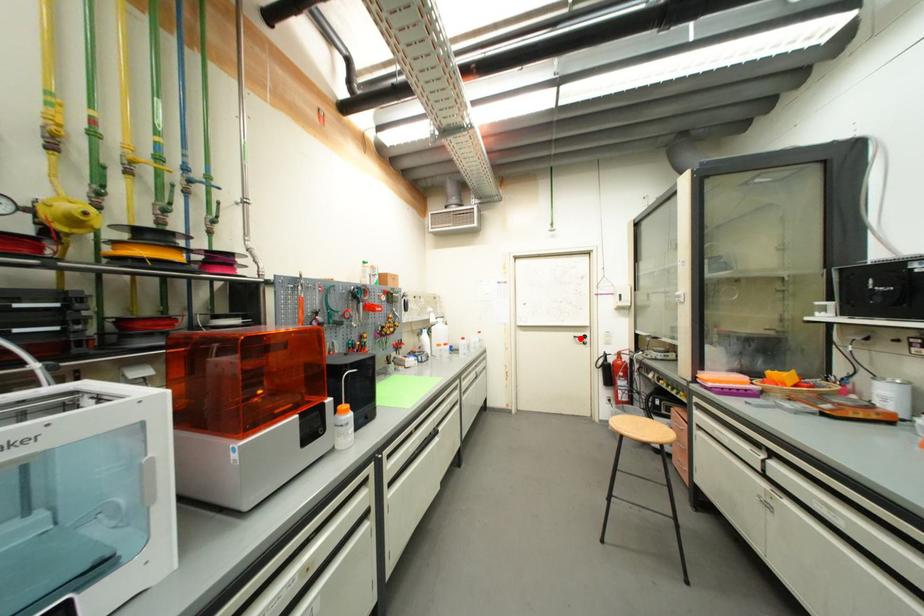
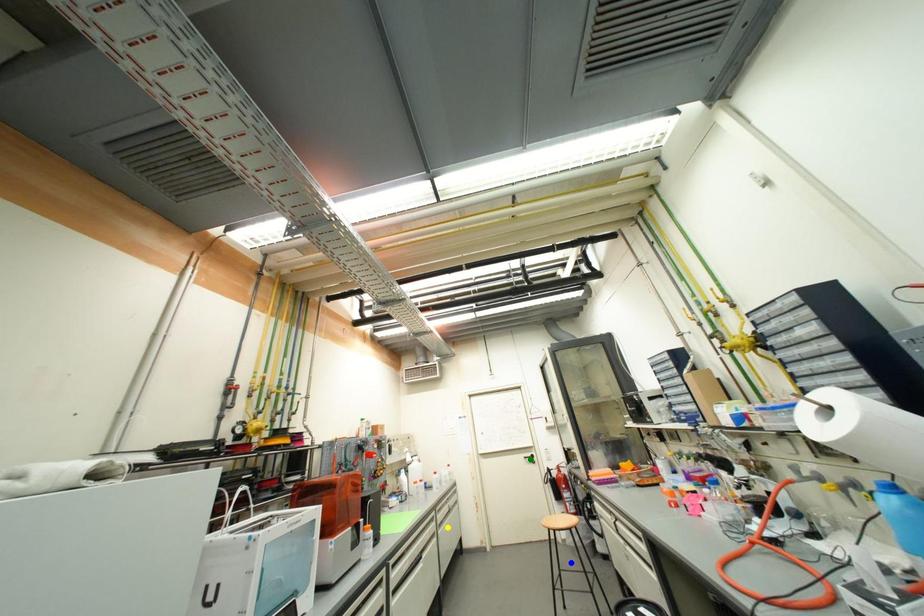
Question: I am providing you with two images of the same scene from different viewpoints. A red point is marked on the first image. You are given multiple points on the second image. Which spot in image 2 lines up with the point in image 1?

Choices:
 (A) blue point
 (B) green point
 (C) yellow point

Answer: (B)